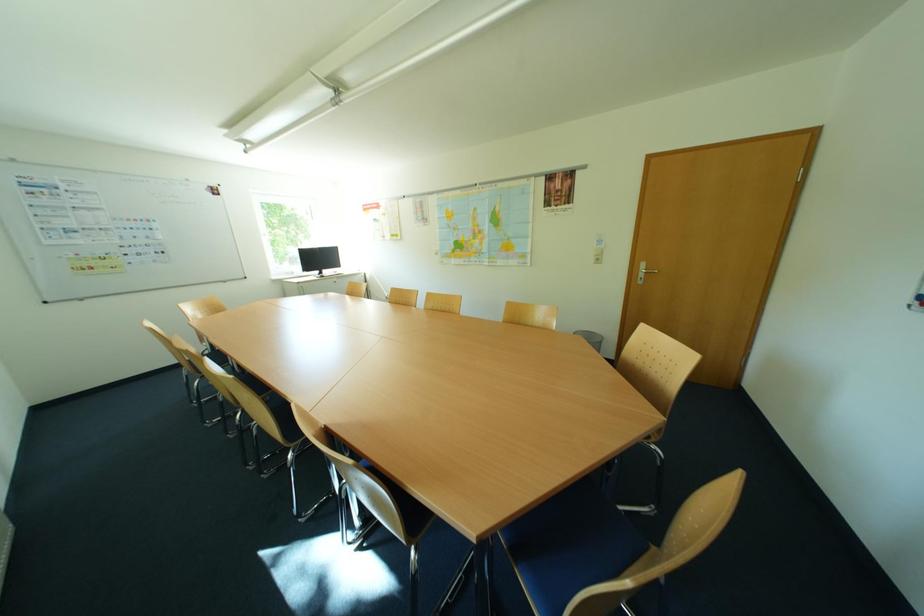
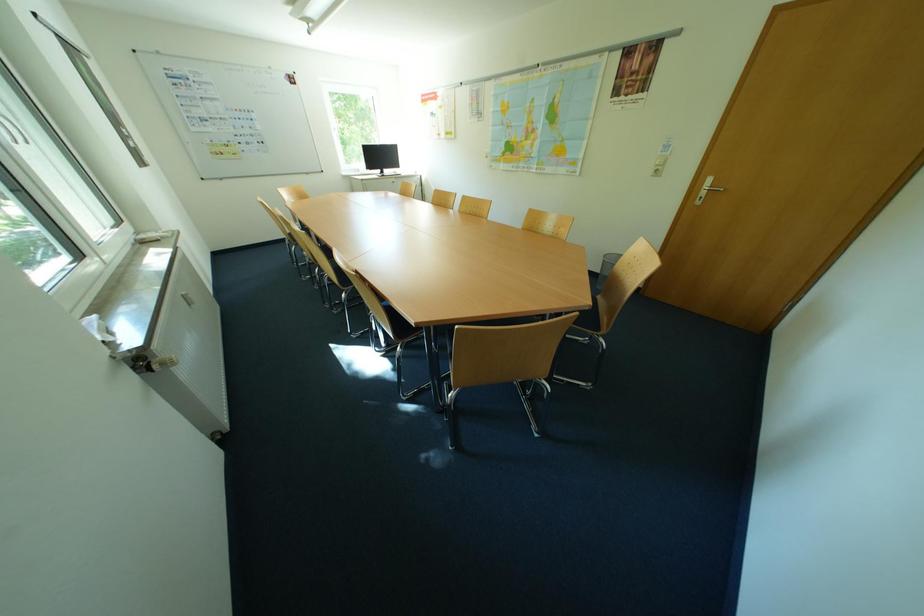
In a continuous first-person perspective shot, in which direction is the camera moving?

The cameraman walked toward right, backward.